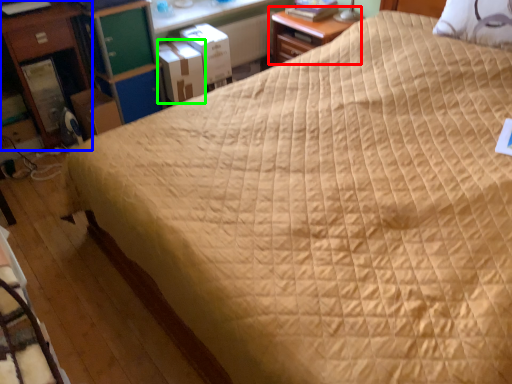
Question: Which object is the closest to the nightstand (highlighted by a red box)? Choose among these: nightstand (highlighted by a blue box) or cardboard box (highlighted by a green box).

Choices:
 (A) nightstand
 (B) cardboard box

Answer: (B)